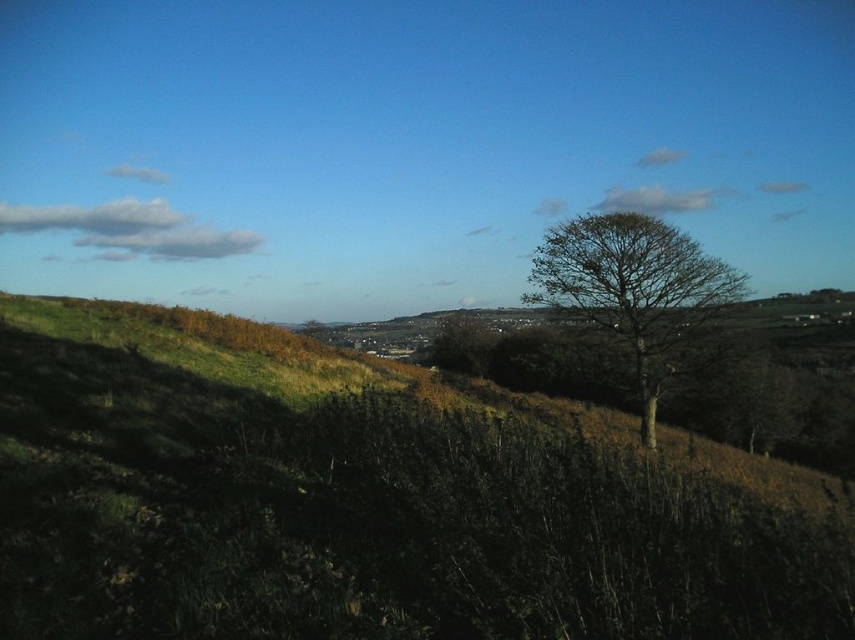
Question: Which point appears farthest from the camera in this image?

Choices:
 (A) (325, 486)
 (B) (578, 278)

Answer: (B)

Question: Does green grassy hillside at center have a smaller size compared to bare wood tree at right?

Choices:
 (A) yes
 (B) no

Answer: (B)

Question: Can you confirm if green grassy hillside at center is wider than bare wood tree at right?

Choices:
 (A) yes
 (B) no

Answer: (A)

Question: Which point is closer to the camera taking this photo?

Choices:
 (A) (652, 280)
 (B) (795, 524)

Answer: (B)

Question: Which point is farther from the camera taking this photo?

Choices:
 (A) (741, 506)
 (B) (640, 320)

Answer: (B)

Question: Observing the image, what is the correct spatial positioning of green grassy hillside at center in reference to bare wood tree at right?

Choices:
 (A) below
 (B) above

Answer: (A)